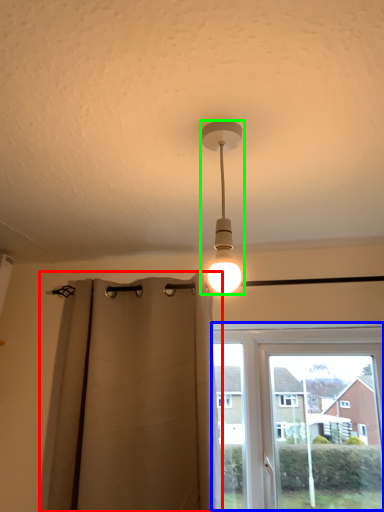
Question: Which object is positioned farthest from curtain (highlighted by a red box)? Select from window (highlighted by a blue box) and lamp (highlighted by a green box).

Choices:
 (A) window
 (B) lamp

Answer: (B)